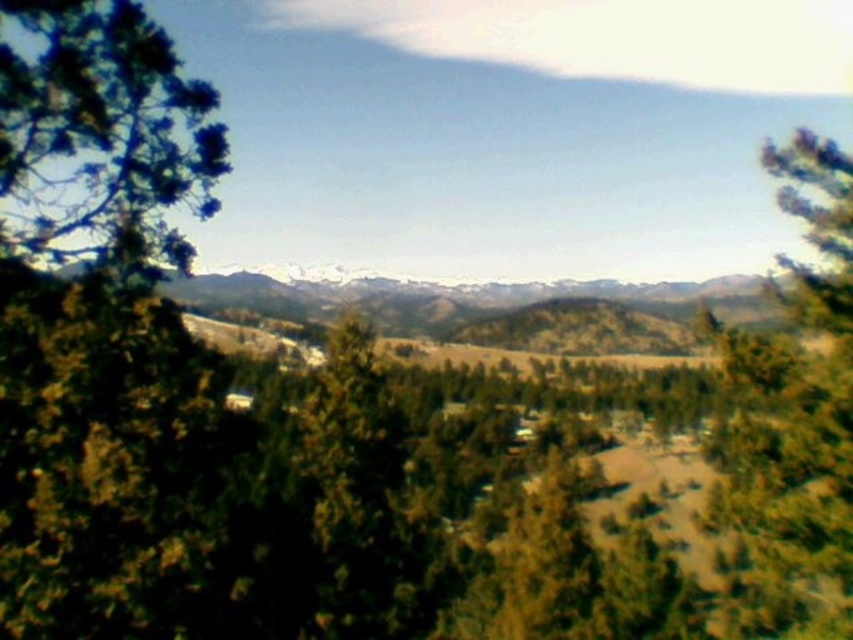
Question: Which object is closer to the camera taking this photo?

Choices:
 (A) green leafy tree at left
 (B) green textured tree at right

Answer: (A)

Question: Can you confirm if green leafy tree at left is positioned to the right of green textured tree at right?

Choices:
 (A) yes
 (B) no

Answer: (B)

Question: Can you confirm if green leafy tree at left is thinner than green textured tree at right?

Choices:
 (A) yes
 (B) no

Answer: (A)

Question: Is green leafy tree at left below green textured tree at right?

Choices:
 (A) yes
 (B) no

Answer: (B)

Question: Which point is farther from the camera taking this photo?

Choices:
 (A) (769, 488)
 (B) (35, 252)

Answer: (A)